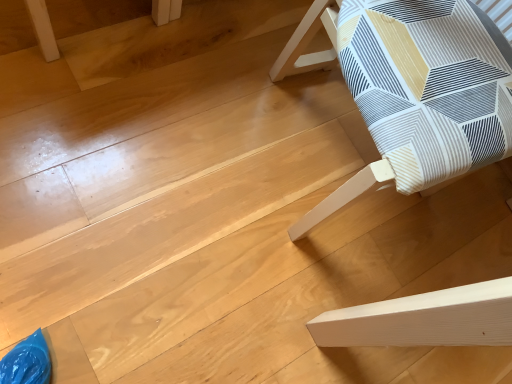
Find the location of a particular element. blank space to the left of white fabric chair at right, placed as the first furniture when sorted from right to left is located at coordinates (200, 74).